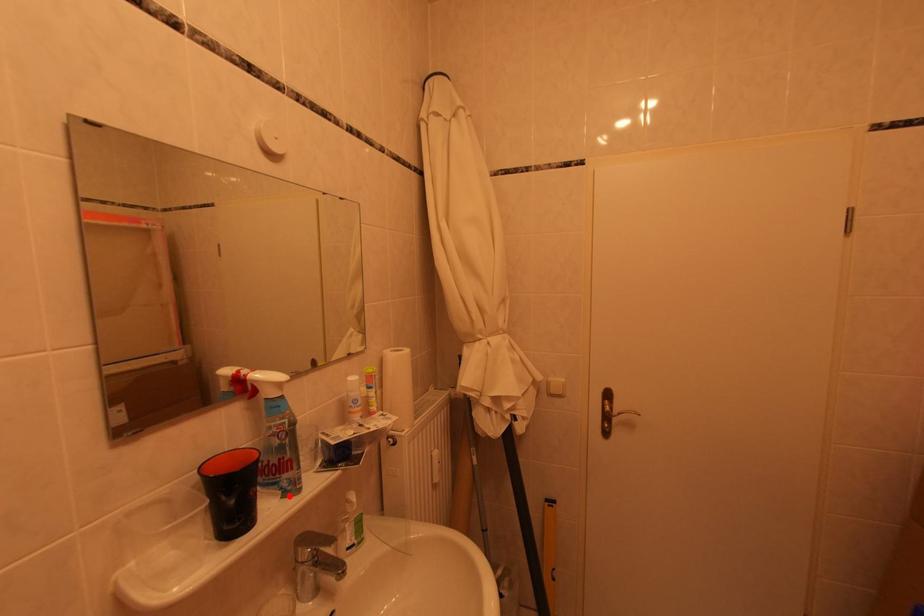
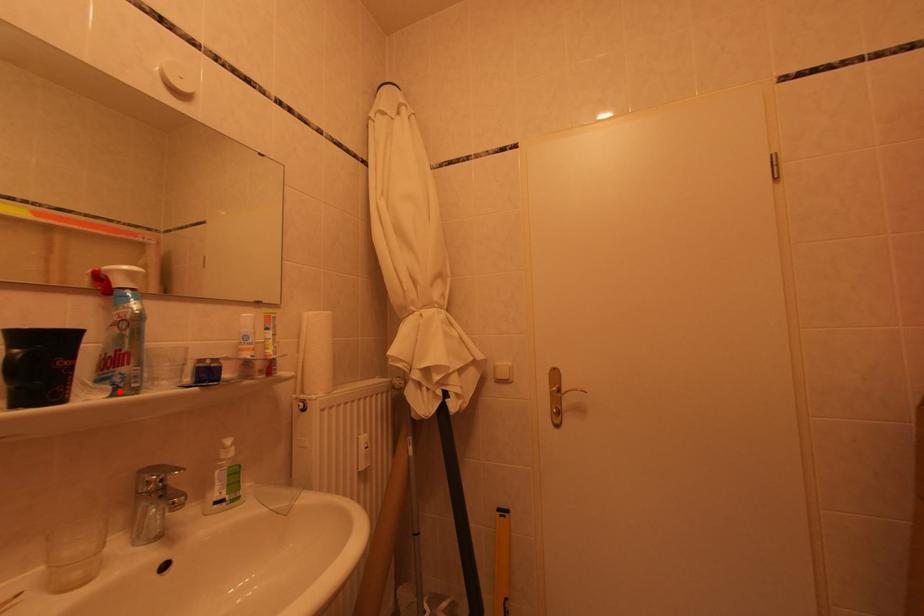
I am providing you with two images of the same scene from different viewpoints. A red point is marked on the first image and another point is marked on the second image. Do the highlighted points in image1 and image2 indicate the same real-world spot?

Yes